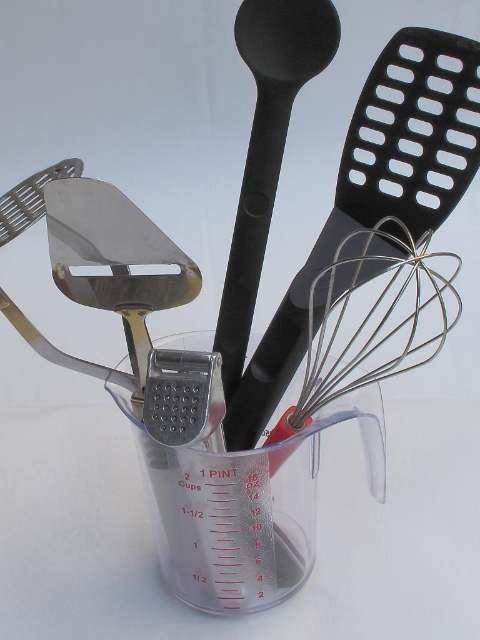
From the picture: Which is more to the right, black plastic spatula at upper right or silver wire whisk at center?

From the viewer's perspective, silver wire whisk at center appears more on the right side.

Which is more to the left, black plastic spatula at upper right or silver wire whisk at center?

Positioned to the left is black plastic spatula at upper right.

What do you see at coordinates (376, 193) in the screenshot?
I see `black plastic spatula at upper right` at bounding box center [376, 193].

Where is `black plastic spatula at upper right`? The height and width of the screenshot is (640, 480). black plastic spatula at upper right is located at coordinates (376, 193).

Which of these two, silver wire whisk at center or black matte spoon at center, stands shorter?

silver wire whisk at center is shorter.

Is silver wire whisk at center to the right of black matte spoon at center from the viewer's perspective?

Yes, silver wire whisk at center is to the right of black matte spoon at center.

What do you see at coordinates (368, 317) in the screenshot? I see `silver wire whisk at center` at bounding box center [368, 317].

At what (x,y) coordinates should I click in order to perform the action: click on silver wire whisk at center. Please return your answer as a coordinate pair (x, y). The width and height of the screenshot is (480, 640). Looking at the image, I should click on tap(368, 317).

Who is positioned more to the right, black plastic spatula at upper right or black matte spoon at center?

black plastic spatula at upper right

Who is higher up, black plastic spatula at upper right or black matte spoon at center?

black matte spoon at center is above.

Is point (416, 189) behind point (237, 26)?

Yes, point (416, 189) is behind point (237, 26).

Image resolution: width=480 pixels, height=640 pixels. What are the coordinates of `black plastic spatula at upper right` in the screenshot? It's located at (376, 193).